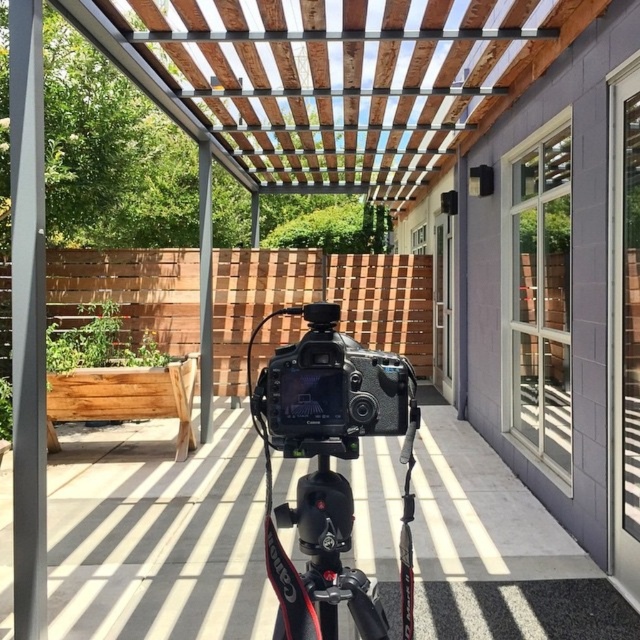
Is smooth gray pole at left taller than black matte tripod at center?

Yes, smooth gray pole at left is taller than black matte tripod at center.

Measure the distance between smooth gray pole at left and camera.

smooth gray pole at left is 2.27 meters away from camera.

Is point (28, 224) positioned in front of point (353, 573)?

No, (28, 224) is behind (353, 573).

Identify the location of smooth gray pole at left. (28, 317).

Which of these two, matte black camera at center or black matte camera at center, stands shorter?

With less height is matte black camera at center.

Is point (563, 636) more distant than point (282, 353)?

Yes.

At what (x,y) coordinates should I click in order to perform the action: click on matte black camera at center. Please return your answer as a coordinate pair (x, y). This screenshot has width=640, height=640. Looking at the image, I should click on (157, 536).

Does point (488, 564) lie behind point (332, 564)?

Yes, point (488, 564) is behind point (332, 564).

How distant is matte black camera at center from black matte tripod at center?

matte black camera at center and black matte tripod at center are 1.69 meters apart from each other.

Image resolution: width=640 pixels, height=640 pixels. What do you see at coordinates (157, 536) in the screenshot?
I see `matte black camera at center` at bounding box center [157, 536].

The height and width of the screenshot is (640, 640). In order to click on matte black camera at center in this screenshot , I will do `click(157, 536)`.